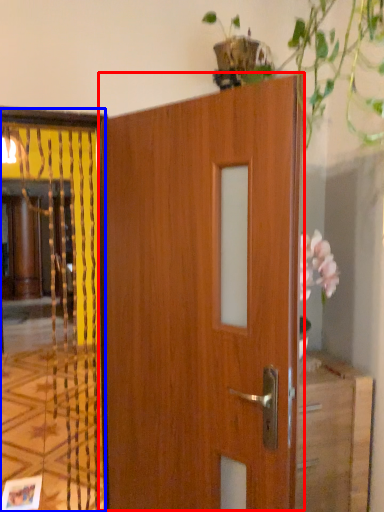
Question: Among these objects, which one is farthest to the camera, door (highlighted by a red box) or elevator (highlighted by a blue box)?

Choices:
 (A) door
 (B) elevator

Answer: (B)